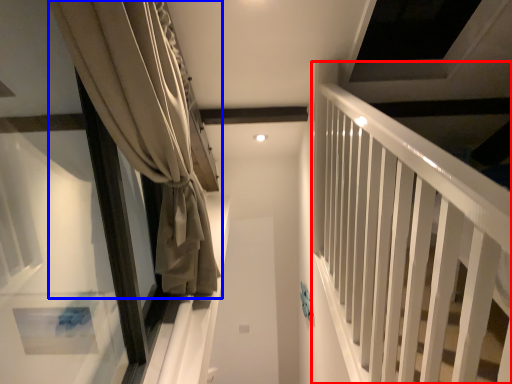
Question: Which object appears closest to the camera in this image, bunk bed (highlighted by a red box) or curtain (highlighted by a blue box)?

Choices:
 (A) bunk bed
 (B) curtain

Answer: (A)